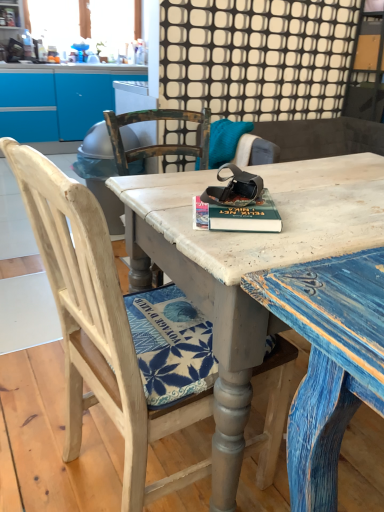
Image resolution: width=384 pixels, height=512 pixels. Identify the location of free space above hardcover book at center (from a real-world perspective). (235, 199).